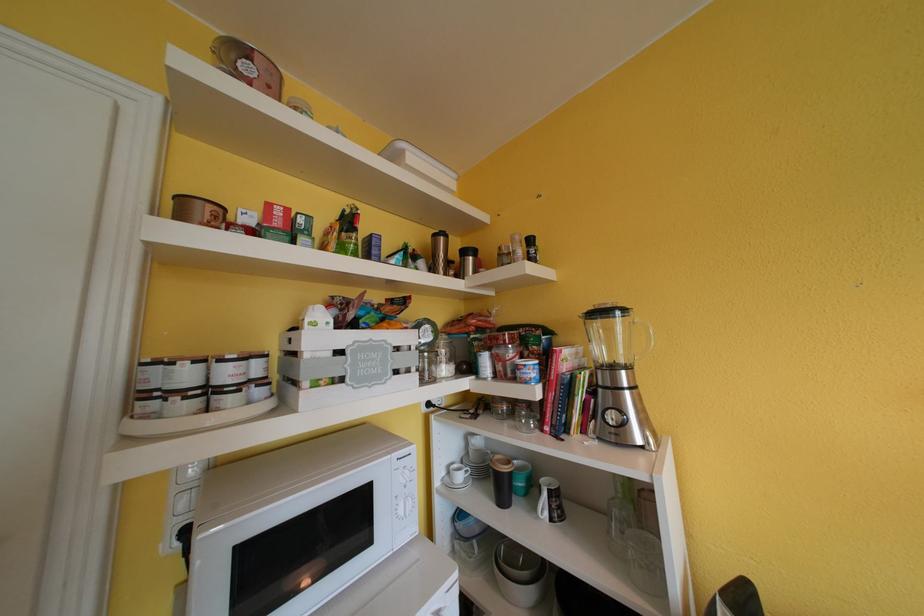
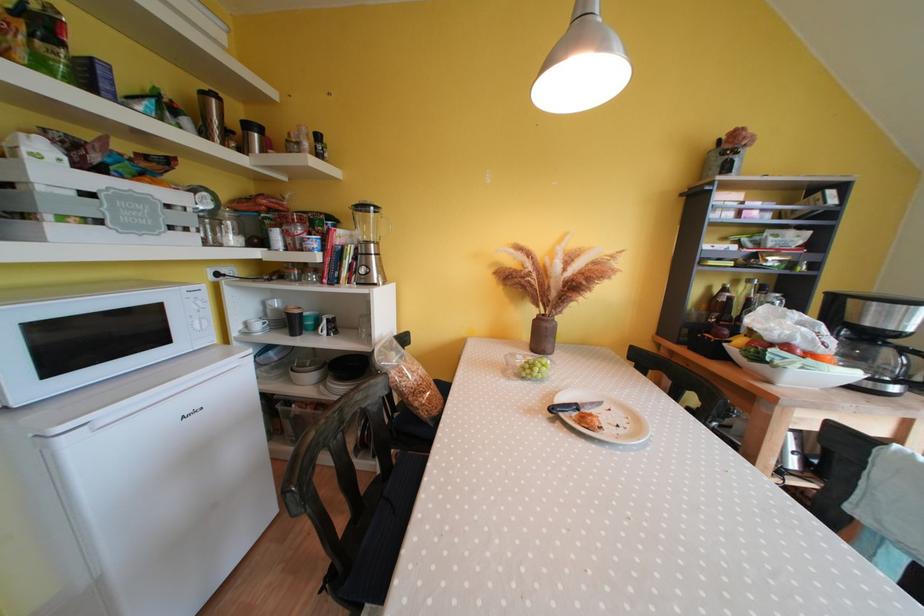
Find the pixel in the second image that matches pixel 629 375 in the first image.

(379, 249)